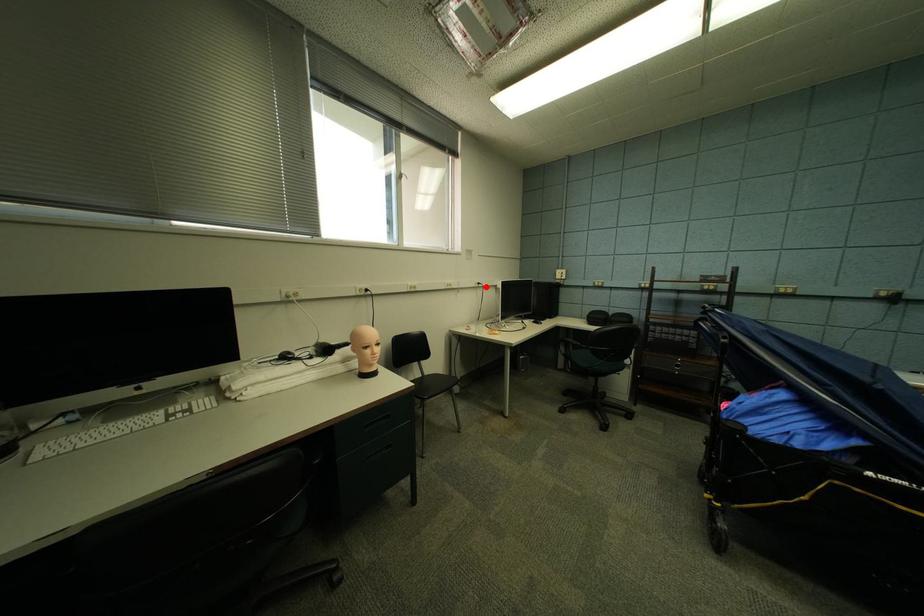
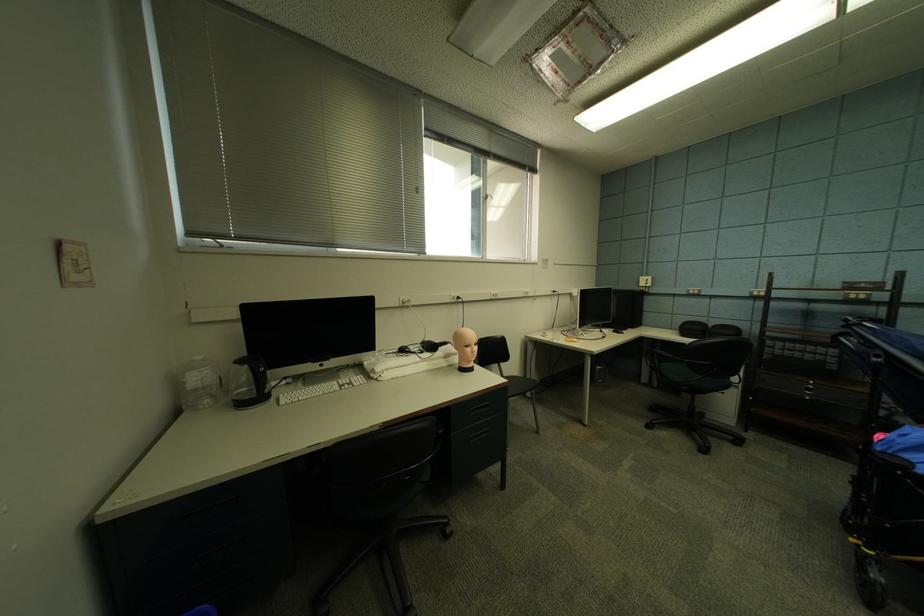
In the second image, find the point that corresponds to the highlighted location in the first image.

(561, 294)